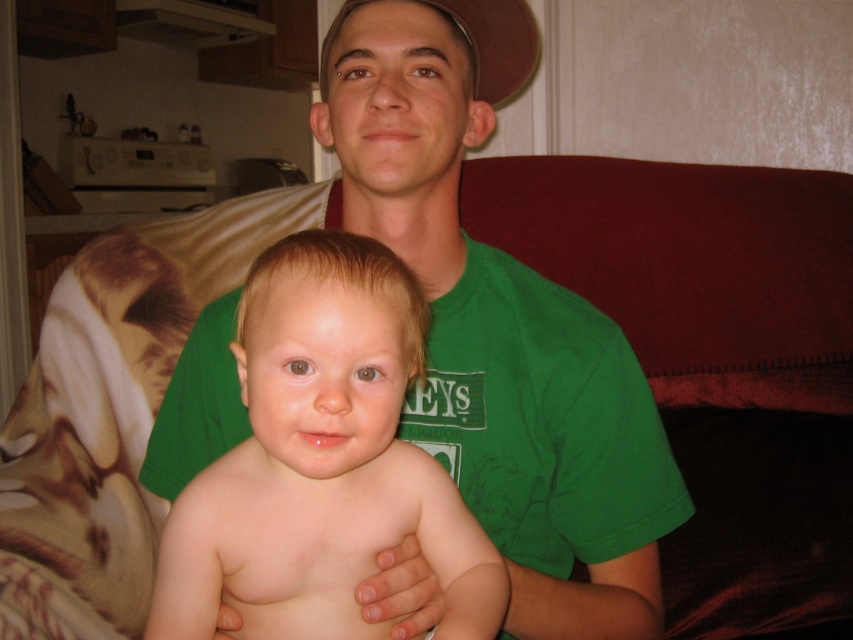
Based on the scene description, where exactly is the green cotton shirt at center located in the image?

The green cotton shirt at center is located at point coordinates of (500, 324).

You are a photographer trying to capture a candid shot of the green cotton shirt at center and the smooth skin baby at center. Since you want to ensure both subjects are in focus, you need to know their relative heights. Which one is taller?

The green cotton shirt at center is taller than smooth skin baby at center.

You are a fashion designer observing the image. You need to determine which item is positioned higher in the scene between the green cotton shirt at center and the brown fabric baseball hat at upper center. Which one is higher?

The brown fabric baseball hat at upper center is positioned higher in the scene than the green cotton shirt at center.